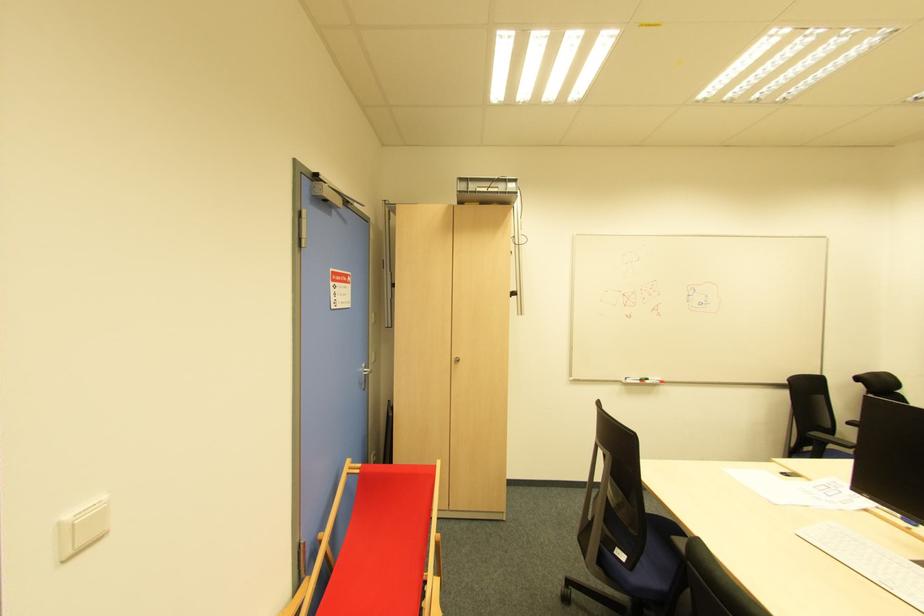
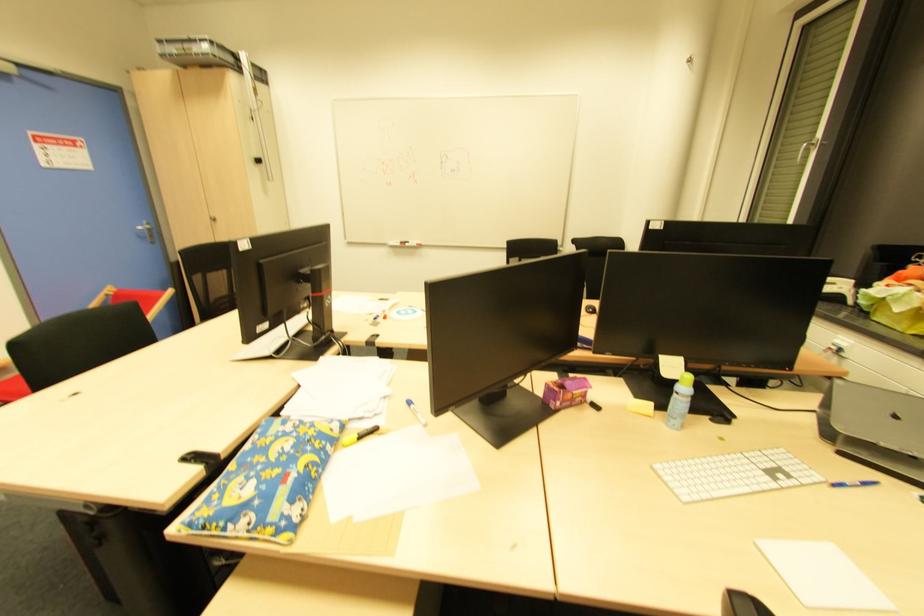
Question: The images are taken continuously from a first-person perspective. In which direction are you moving?

Choices:
 (A) Left
 (B) Right
 (C) Forward
 (D) Backward

Answer: (B)